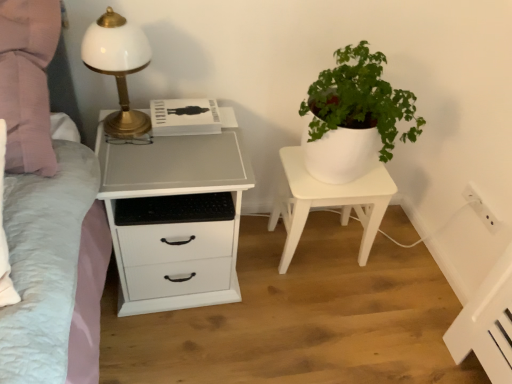
The height and width of the screenshot is (384, 512). Identify the location of vacant area that is in front of white matte chest of drawers at left. (179, 345).